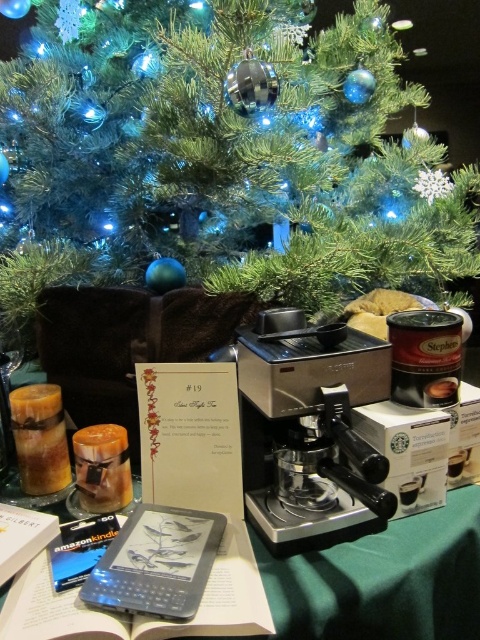
Consider the image. You are setting up a holiday display and need to place a decorative item between the sleek metallic coffee machine at center and the green matte christmas tree at upper center. Based on their positions, where should you place the item to ensure it is centered between them?

The sleek metallic coffee machine at center is to the left of the green matte christmas tree at upper center, so placing the decorative item between them would require positioning it to the right of the coffee machine and to the left of the tree to be centered.

You are a barista preparing drinks for a holiday event. You need to place a new coffee machine that is 6 inches wide on the table. The table has limited space between the existing items. Can the sleek metallic coffee machine at center fit between the existing items without overlapping the hardcover book at center?

The sleek metallic coffee machine at center and hardcover book at center are 6.08 inches apart. Since the coffee machine is 6 inches wide, there is enough space between them to place it without overlapping the hardcover book at center.